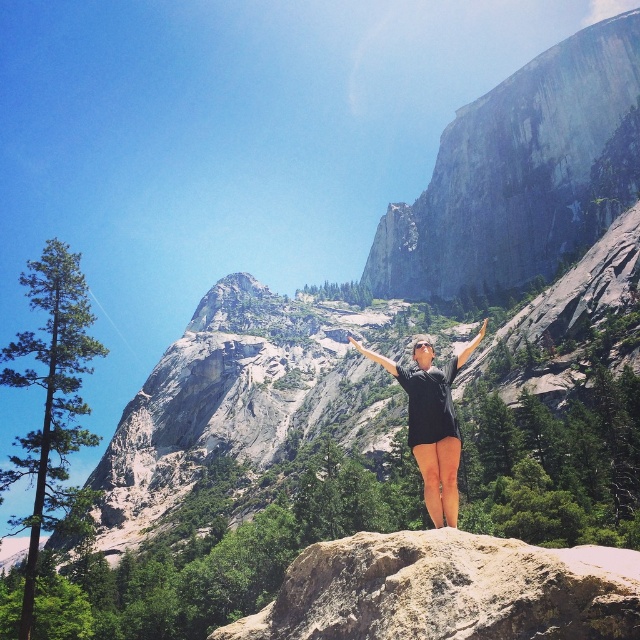
Does smooth granite cliff at upper right appear over smooth beige rock at center?

Correct, smooth granite cliff at upper right is located above smooth beige rock at center.

Is smooth granite cliff at upper right smaller than smooth beige rock at center?

No.

The width and height of the screenshot is (640, 640). What do you see at coordinates (516, 172) in the screenshot?
I see `smooth granite cliff at upper right` at bounding box center [516, 172].

This screenshot has height=640, width=640. I want to click on smooth granite cliff at upper right, so click(x=516, y=172).

Can you confirm if smooth granite cliff at upper right is positioned below black fabric arm at center?

No, smooth granite cliff at upper right is not below black fabric arm at center.

Who is shorter, smooth granite cliff at upper right or black fabric arm at center?

With less height is black fabric arm at center.

Between point (589, 188) and point (390, 371), which one is positioned in front?

Point (390, 371)

Locate an element on the screen. smooth granite cliff at upper right is located at coordinates (516, 172).

Does point (484, 317) lie behind point (353, 342)?

Yes, point (484, 317) is farther from viewer.

Which of these two, black matte arm at center or smooth skin hand at center, stands taller?

With more height is black matte arm at center.

Between point (481, 339) and point (358, 342), which one is positioned in front?

Point (481, 339) is more forward.

Find the location of a particular element. black matte arm at center is located at coordinates (470, 346).